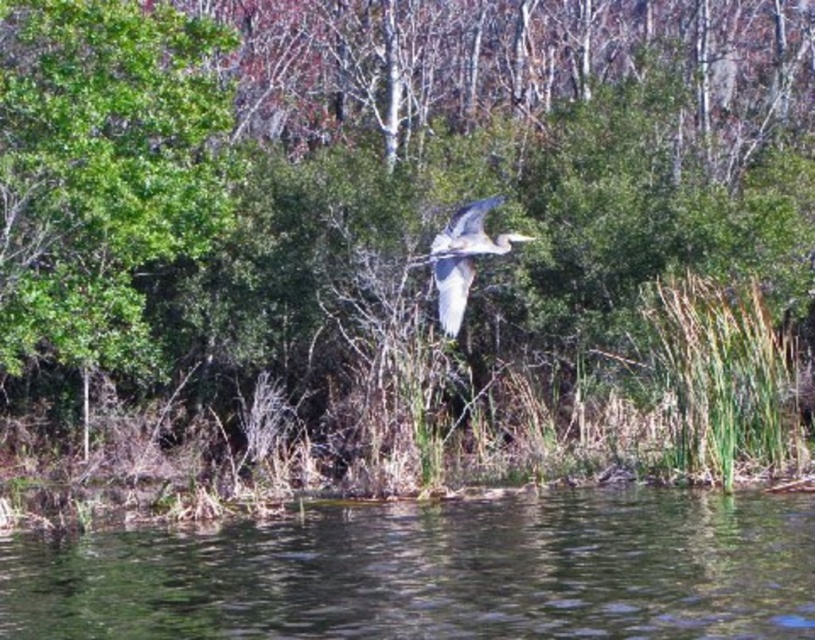
You are standing at the point with coordinates point (379, 180). Looking around, what do you see directly in front of you?

You see the green leafy tree at upper center directly in front of you.

You are a photographer trying to capture the gray feathered heron at center while ensuring the clear water at lower center is also visible in the frame. Based on their heights, which object should you focus on first to ensure both are in focus?

The gray feathered heron at center is taller than the clear water at lower center. To ensure both are in focus, you should focus on the gray feathered heron at center first since it is taller and will require adjusting the depth of field to include the lower clear water at lower center.